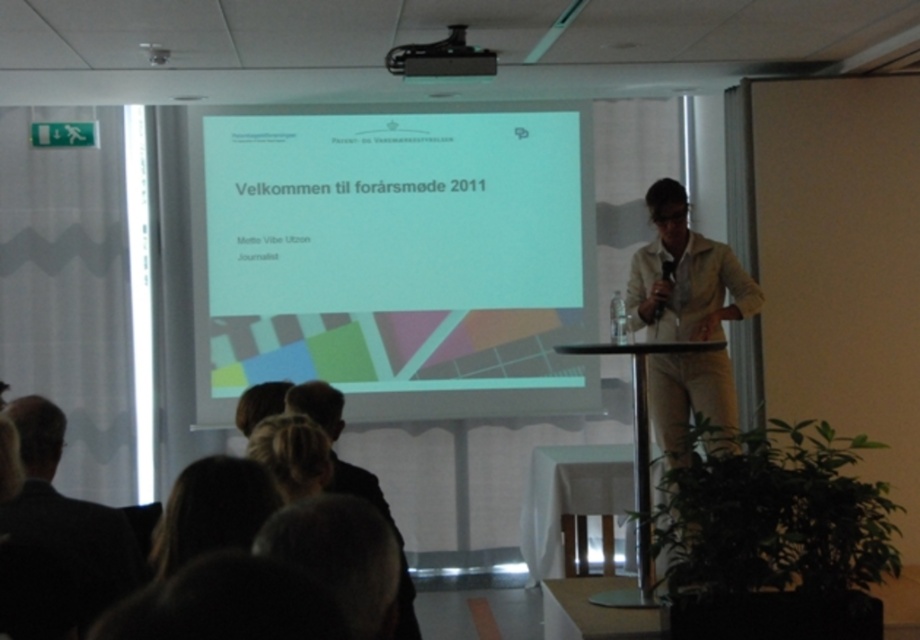
Between white matte projection screen at center and black plastic projector at upper center, which one appears on the left side from the viewer's perspective?

From the viewer's perspective, white matte projection screen at center appears more on the left side.

What do you see at coordinates (397, 259) in the screenshot? The height and width of the screenshot is (640, 920). I see `white matte projection screen at center` at bounding box center [397, 259].

Locate an element on the screen. This screenshot has width=920, height=640. white matte projection screen at center is located at coordinates (397, 259).

Can you confirm if white matte projection screen at center is positioned to the left of dark suit at lower left?

In fact, white matte projection screen at center is to the right of dark suit at lower left.

Image resolution: width=920 pixels, height=640 pixels. What do you see at coordinates (397, 259) in the screenshot?
I see `white matte projection screen at center` at bounding box center [397, 259].

Is point (271, 348) more distant than point (78, 572)?

Yes.

The image size is (920, 640). I want to click on white matte projection screen at center, so click(397, 259).

Between dark suit at lower left and dark brown hair at lower center, which one has more height?

With more height is dark brown hair at lower center.

Who is more distant from viewer, (46, 474) or (351, 492)?

The point (351, 492) is behind.

Does point (23, 440) lie behind point (319, 384)?

No, (23, 440) is closer to viewer.

What are the coordinates of `dark suit at lower left` in the screenshot? It's located at (69, 509).